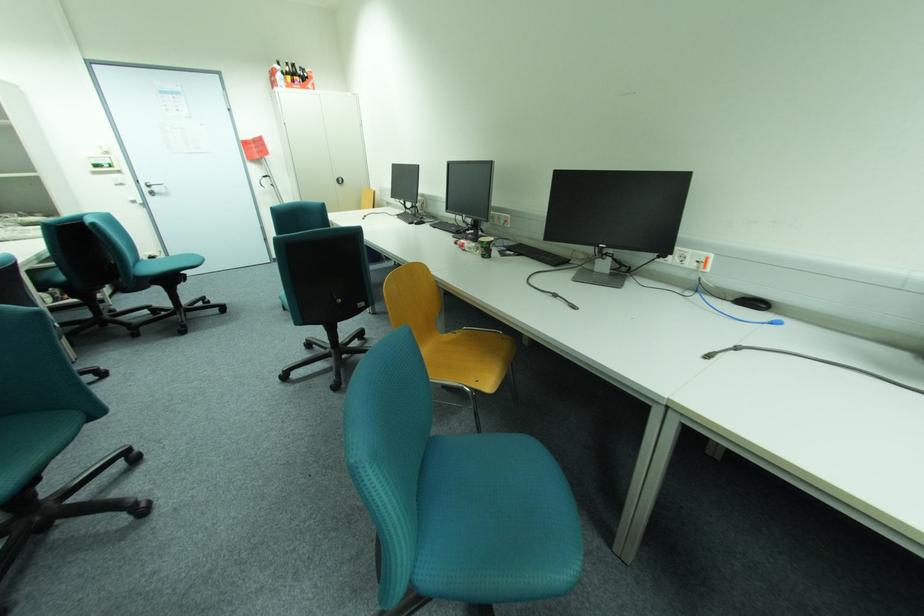
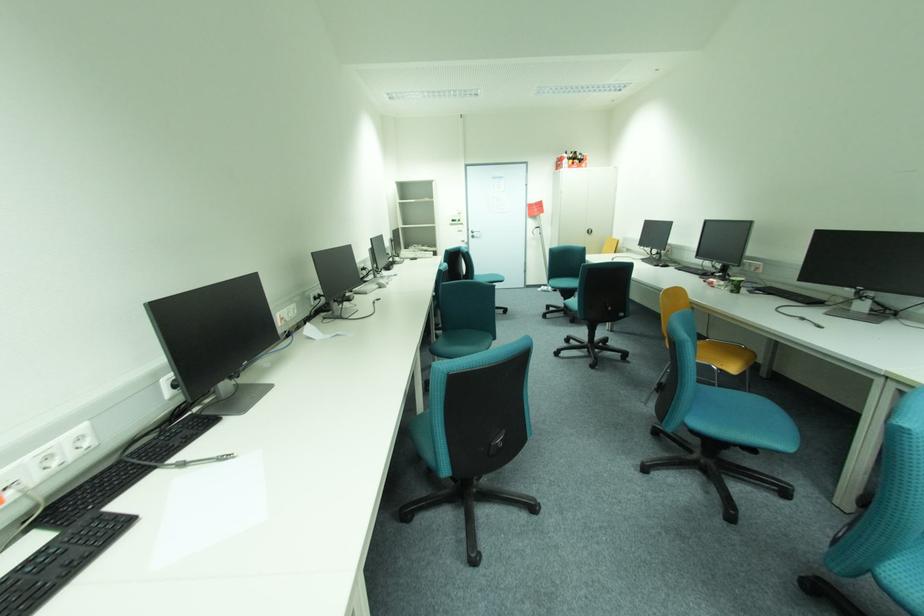
Find the pixel in the second image that matches point (152, 190) in the first image.

(477, 235)